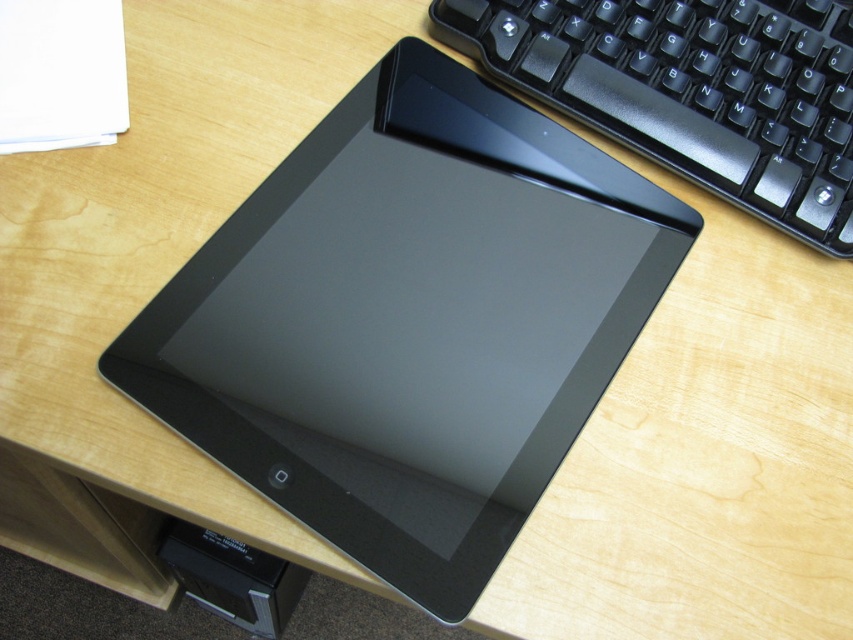
Question: Does sleek black tablet at center have a greater width compared to black plastic keyboard at upper right?

Choices:
 (A) yes
 (B) no

Answer: (A)

Question: Which object appears farthest from the camera in this image?

Choices:
 (A) black plastic keyboard at upper right
 (B) sleek black tablet at center

Answer: (A)

Question: Which of the following is the farthest from the observer?

Choices:
 (A) (485, 216)
 (B) (712, 100)

Answer: (B)

Question: Does sleek black tablet at center have a greater width compared to black plastic keyboard at upper right?

Choices:
 (A) yes
 (B) no

Answer: (A)

Question: From the image, what is the correct spatial relationship of sleek black tablet at center in relation to black plastic keyboard at upper right?

Choices:
 (A) below
 (B) above

Answer: (A)